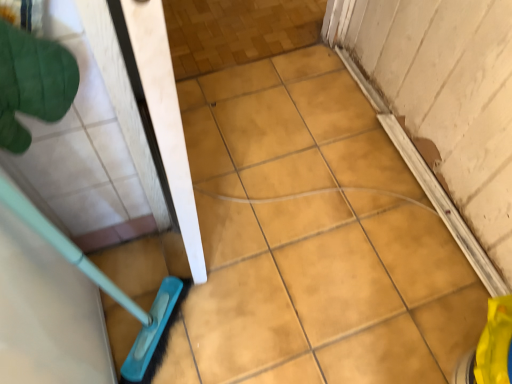
Describe the element at coordinates (316, 236) in the screenshot. The width and height of the screenshot is (512, 384). I see `yellow matte tile at center, which is counted as the 1th ceramic tile, starting from the left` at that location.

Describe the element at coordinates (453, 324) in the screenshot. I see `yellow matte tile at lower right, the first ceramic tile in the right-to-left sequence` at that location.

At what (x,y) coordinates should I click in order to perform the action: click on yellow matte tile at center, placed as the second ceramic tile when sorted from right to left. Please return your answer as a coordinate pair (x, y). The image size is (512, 384). Looking at the image, I should click on (316, 236).

Considering the sizes of yellow matte tile at lower right, the first ceramic tile in the right-to-left sequence, and green fabric glove at upper left in the image, is yellow matte tile at lower right, the first ceramic tile in the right-to-left sequence, wider or thinner than green fabric glove at upper left?

Considering their sizes, yellow matte tile at lower right, the first ceramic tile in the right-to-left sequence, looks broader than green fabric glove at upper left.

Considering the positions of points (474, 330) and (42, 94), is point (474, 330) closer to camera compared to point (42, 94)?

No, it is not.

Is yellow matte tile at lower right, which appears as the 2th ceramic tile when viewed from the left, located outside green fabric glove at upper left?

That's correct, yellow matte tile at lower right, which appears as the 2th ceramic tile when viewed from the left, is outside of green fabric glove at upper left.

Which of these two, yellow matte tile at lower right, the first ceramic tile in the right-to-left sequence, or green fabric glove at upper left, stands taller?

yellow matte tile at lower right, the first ceramic tile in the right-to-left sequence.

Based on their sizes in the image, would you say green fabric glove at upper left is bigger or smaller than yellow matte tile at center, which is counted as the 1th ceramic tile, starting from the left?

In the image, green fabric glove at upper left appears to be smaller than yellow matte tile at center, which is counted as the 1th ceramic tile, starting from the left.

Is green fabric glove at upper left at the left side of yellow matte tile at center, placed as the second ceramic tile when sorted from right to left?

Yes, green fabric glove at upper left is to the left of yellow matte tile at center, placed as the second ceramic tile when sorted from right to left.

From their relative heights in the image, would you say green fabric glove at upper left is taller or shorter than yellow matte tile at center, placed as the second ceramic tile when sorted from right to left?

In the image, green fabric glove at upper left appears to be taller than yellow matte tile at center, placed as the second ceramic tile when sorted from right to left.

Is point (44, 81) in front of point (448, 298)?

Yes, it is.

Looking at this image, does yellow matte tile at lower right, which appears as the 2th ceramic tile when viewed from the left, have a lesser width compared to yellow matte tile at center, placed as the second ceramic tile when sorted from right to left?

Yes.

Measure the distance between yellow matte tile at lower right, which appears as the 2th ceramic tile when viewed from the left, and yellow matte tile at center, which is counted as the 1th ceramic tile, starting from the left.

The distance of yellow matte tile at lower right, which appears as the 2th ceramic tile when viewed from the left, from yellow matte tile at center, which is counted as the 1th ceramic tile, starting from the left, is 13.30 inches.

From a real-world perspective, does yellow matte tile at lower right, which appears as the 2th ceramic tile when viewed from the left, stand above yellow matte tile at center, placed as the second ceramic tile when sorted from right to left?

Yes, from a real-world perspective, yellow matte tile at lower right, which appears as the 2th ceramic tile when viewed from the left, is over yellow matte tile at center, placed as the second ceramic tile when sorted from right to left

Which is nearer, (440,350) or (233,343)?

The point (233,343) is more forward.

Which object is wider, yellow matte tile at center, which is counted as the 1th ceramic tile, starting from the left, or yellow matte tile at lower right, the first ceramic tile in the right-to-left sequence?

yellow matte tile at center, which is counted as the 1th ceramic tile, starting from the left.

Is yellow matte tile at center, placed as the second ceramic tile when sorted from right to left, not within yellow matte tile at lower right, which appears as the 2th ceramic tile when viewed from the left?

Yes, yellow matte tile at center, placed as the second ceramic tile when sorted from right to left, is not within yellow matte tile at lower right, which appears as the 2th ceramic tile when viewed from the left.

Does yellow matte tile at center, which is counted as the 1th ceramic tile, starting from the left, touch yellow matte tile at lower right, which appears as the 2th ceramic tile when viewed from the left?

yellow matte tile at center, which is counted as the 1th ceramic tile, starting from the left, and yellow matte tile at lower right, which appears as the 2th ceramic tile when viewed from the left, are not in contact.

In the scene shown: Is yellow matte tile at center, placed as the second ceramic tile when sorted from right to left, spatially inside green fabric glove at upper left, or outside of it?

yellow matte tile at center, placed as the second ceramic tile when sorted from right to left, is located beyond the bounds of green fabric glove at upper left.

Can you confirm if yellow matte tile at center, placed as the second ceramic tile when sorted from right to left, is positioned to the right of green fabric glove at upper left?

Yes, yellow matte tile at center, placed as the second ceramic tile when sorted from right to left, is to the right of green fabric glove at upper left.

What's the angular difference between yellow matte tile at center, which is counted as the 1th ceramic tile, starting from the left, and green fabric glove at upper left's facing directions?

171 degrees.

Is yellow matte tile at center, placed as the second ceramic tile when sorted from right to left, facing towards green fabric glove at upper left?

No, yellow matte tile at center, placed as the second ceramic tile when sorted from right to left, does not turn towards green fabric glove at upper left.

Who is bigger, green fabric glove at upper left or yellow matte tile at lower right, which appears as the 2th ceramic tile when viewed from the left?

yellow matte tile at lower right, which appears as the 2th ceramic tile when viewed from the left, is bigger.

Does green fabric glove at upper left come behind yellow matte tile at lower right, which appears as the 2th ceramic tile when viewed from the left?

No, green fabric glove at upper left is in front of yellow matte tile at lower right, which appears as the 2th ceramic tile when viewed from the left.

Between green fabric glove at upper left and yellow matte tile at lower right, the first ceramic tile in the right-to-left sequence, which one appears on the left side from the viewer's perspective?

green fabric glove at upper left is more to the left.

Which is in front, point (59, 66) or point (452, 336)?

The point (59, 66) is in front.

The width and height of the screenshot is (512, 384). In order to click on hand on the left of yellow matte tile at lower right, which appears as the 2th ceramic tile when viewed from the left in this screenshot , I will do `click(32, 83)`.

The height and width of the screenshot is (384, 512). In order to click on the 1st ceramic tile below when counting from the green fabric glove at upper left (from the image's perspective) in this screenshot , I will do `click(316, 236)`.

When comparing their distances from green fabric glove at upper left, does yellow matte tile at center, which is counted as the 1th ceramic tile, starting from the left, or yellow matte tile at lower right, the first ceramic tile in the right-to-left sequence, seem closer?

The object closer to green fabric glove at upper left is yellow matte tile at center, which is counted as the 1th ceramic tile, starting from the left.

Looking at this image, when comparing their distances from yellow matte tile at lower right, which appears as the 2th ceramic tile when viewed from the left, does green fabric glove at upper left or yellow matte tile at center, placed as the second ceramic tile when sorted from right to left, seem further?

green fabric glove at upper left.

Based on their spatial positions, is green fabric glove at upper left or yellow matte tile at lower right, the first ceramic tile in the right-to-left sequence, closer to yellow matte tile at center, which is counted as the 1th ceramic tile, starting from the left?

Based on the image, yellow matte tile at lower right, the first ceramic tile in the right-to-left sequence, appears to be nearer to yellow matte tile at center, which is counted as the 1th ceramic tile, starting from the left.

Considering their positions, is yellow matte tile at lower right, the first ceramic tile in the right-to-left sequence, positioned further to green fabric glove at upper left than yellow matte tile at center, placed as the second ceramic tile when sorted from right to left?

yellow matte tile at lower right, the first ceramic tile in the right-to-left sequence.

Looking at the image, which one is located closer to yellow matte tile at center, placed as the second ceramic tile when sorted from right to left, yellow matte tile at lower right, the first ceramic tile in the right-to-left sequence, or green fabric glove at upper left?

yellow matte tile at lower right, the first ceramic tile in the right-to-left sequence.

From the picture: When comparing their distances from yellow matte tile at lower right, the first ceramic tile in the right-to-left sequence, does yellow matte tile at center, placed as the second ceramic tile when sorted from right to left, or green fabric glove at upper left seem closer?

Among the two, yellow matte tile at center, placed as the second ceramic tile when sorted from right to left, is located nearer to yellow matte tile at lower right, the first ceramic tile in the right-to-left sequence.

Identify the location of ceramic tile located between green fabric glove at upper left and yellow matte tile at lower right, which appears as the 2th ceramic tile when viewed from the left, in the left-right direction. (316, 236).